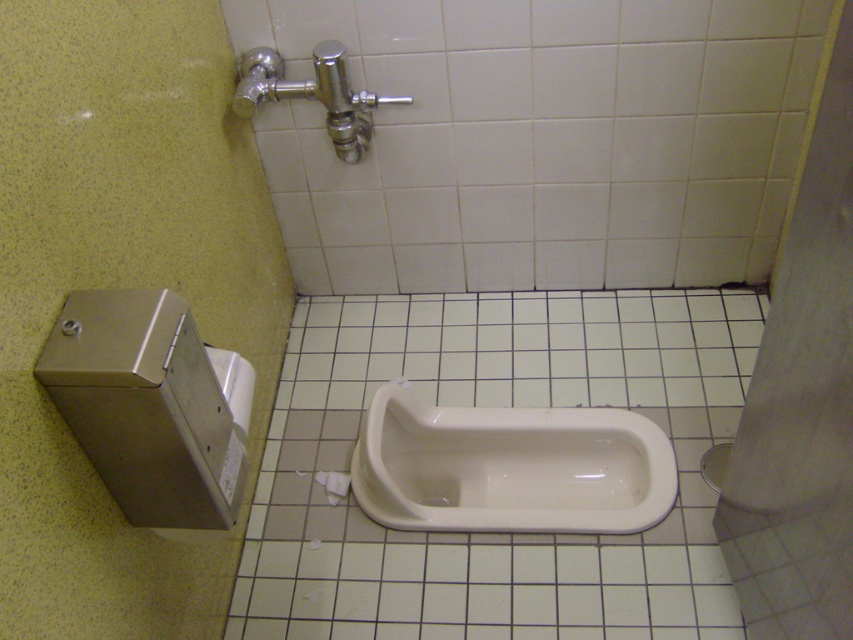
Question: Which object appears closest to the camera in this image?

Choices:
 (A) white glossy urinal at center
 (B) white matte toilet paper at lower center
 (C) white glossy toilet at center

Answer: (C)

Question: Can you confirm if white glossy toilet at center is bigger than white glossy urinal at center?

Choices:
 (A) yes
 (B) no

Answer: (A)

Question: Which of the following is the farthest from the observer?

Choices:
 (A) white glossy urinal at center
 (B) white matte toilet paper at lower center
 (C) white glossy toilet at center

Answer: (B)

Question: Considering the relative positions of white glossy urinal at center and white matte toilet paper at lower center in the image provided, where is white glossy urinal at center located with respect to white matte toilet paper at lower center?

Choices:
 (A) right
 (B) left

Answer: (A)

Question: Can you confirm if white glossy toilet at center is bigger than white matte toilet paper at lower center?

Choices:
 (A) no
 (B) yes

Answer: (B)

Question: Which point is farther from the camera taking this photo?

Choices:
 (A) (517, 518)
 (B) (329, 477)
 (C) (347, 595)

Answer: (B)